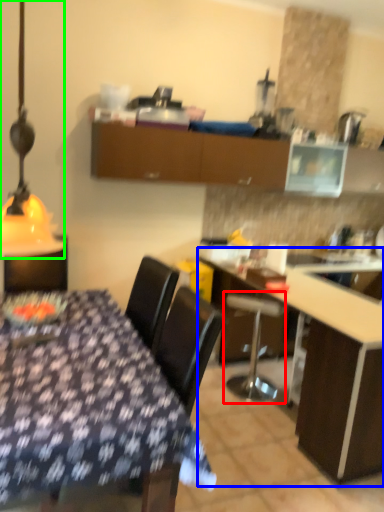
Question: Which object is positioned closest to bar stool (highlighted by a red box)? Select from table (highlighted by a blue box) and table lamp (highlighted by a green box).

Choices:
 (A) table
 (B) table lamp

Answer: (A)